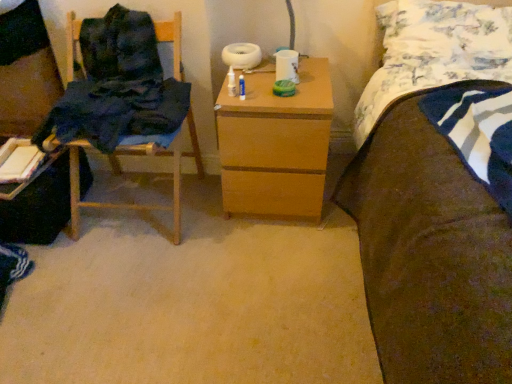
From the picture: What is the approximate height of brown fabric bed at right?

The height of brown fabric bed at right is 86.47 centimeters.

What do you see at coordinates (430, 252) in the screenshot? I see `brown fabric bed at right` at bounding box center [430, 252].

In order to face white cardboard book at left, should I rotate leftwards or rightwards?

To align with it, rotate left about 29.332°.

Measure the distance between point (493,45) and camera.

Point (493,45) and camera are 1.61 meters apart from each other.

Image resolution: width=512 pixels, height=384 pixels. What do you see at coordinates (448, 25) in the screenshot?
I see `floral fabric pillow at upper right` at bounding box center [448, 25].

Locate an element on the screen. The height and width of the screenshot is (384, 512). brown fabric bed at right is located at coordinates (430, 252).

Is point (262, 153) in front of point (436, 9)?

Yes.

Is wooden nightstand at center wider than floral fabric pillow at upper right?

Correct, the width of wooden nightstand at center exceeds that of floral fabric pillow at upper right.

Between wooden nightstand at center and floral fabric pillow at upper right, which one has smaller size?

floral fabric pillow at upper right is smaller.

Consider the image. Does wooden nightstand at center have a lesser height compared to floral fabric pillow at upper right?

No, wooden nightstand at center is not shorter than floral fabric pillow at upper right.

The image size is (512, 384). In order to click on bed in front of the wooden nightstand at center in this screenshot , I will do `click(430, 252)`.

Is wooden nightstand at center next to brown fabric bed at right?

No, wooden nightstand at center is not touching brown fabric bed at right.

Does wooden nightstand at center appear on the right side of brown fabric bed at right?

Incorrect, wooden nightstand at center is not on the right side of brown fabric bed at right.

Is wooden nightstand at center looking in the opposite direction of brown fabric bed at right?

wooden nightstand at center is not turned away from brown fabric bed at right.

In terms of height, does brown fabric bed at right look taller or shorter compared to floral fabric pillow at upper right?

Clearly, brown fabric bed at right is taller compared to floral fabric pillow at upper right.

Consider the image. Can you confirm if brown fabric bed at right is wider than floral fabric pillow at upper right?

Indeed, brown fabric bed at right has a greater width compared to floral fabric pillow at upper right.

Find the location of a particular element. pillow on the right of brown fabric bed at right is located at coordinates (448, 25).

Is point (12, 153) less distant than point (386, 43)?

No, it is not.

Could you tell me if white cardboard book at left is turned towards floral fabric pillow at upper right?

No, white cardboard book at left is not aimed at floral fabric pillow at upper right.

Is white cardboard book at left at the left side of floral fabric pillow at upper right?

Indeed, white cardboard book at left is positioned on the left side of floral fabric pillow at upper right.

Is brown fabric bed at right at the left side of dark blue fabric chair at left?

No, brown fabric bed at right is not to the left of dark blue fabric chair at left.

Looking at the image, does brown fabric bed at right seem bigger or smaller compared to dark blue fabric chair at left?

Considering their sizes, brown fabric bed at right takes up more space than dark blue fabric chair at left.

Considering the positions of objects brown fabric bed at right and dark blue fabric chair at left in the image provided, who is behind, brown fabric bed at right or dark blue fabric chair at left?

Positioned behind is dark blue fabric chair at left.

Consider the image. Would you say brown fabric bed at right is inside or outside dark blue fabric chair at left?

brown fabric bed at right is outside dark blue fabric chair at left.

How many degrees apart are the facing directions of white cardboard book at left and dark blue fabric chair at left?

There is a 3.51-degree angle between the facing directions of white cardboard book at left and dark blue fabric chair at left.

Between white cardboard book at left and dark blue fabric chair at left, which one appears on the left side from the viewer's perspective?

Positioned to the left is dark blue fabric chair at left.

Do you think white cardboard book at left is within dark blue fabric chair at left, or outside of it?

white cardboard book at left cannot be found inside dark blue fabric chair at left.

Is white cardboard book at left oriented away from dark blue fabric chair at left?

Absolutely, white cardboard book at left is directed away from dark blue fabric chair at left.

Between dark blue fabric chair at left and wooden nightstand at center, which one has smaller size?

Smaller between the two is dark blue fabric chair at left.

Does point (62, 88) come closer to viewer compared to point (294, 218)?

No, (62, 88) is behind (294, 218).

Would you say dark blue fabric chair at left contains wooden nightstand at center?

No, wooden nightstand at center is not inside dark blue fabric chair at left.

Where is `nightstand beneath the floral fabric pillow at upper right (from a real-world perspective)`? This screenshot has width=512, height=384. nightstand beneath the floral fabric pillow at upper right (from a real-world perspective) is located at coordinates (276, 145).

Where is `bed in front of the wooden nightstand at center`? bed in front of the wooden nightstand at center is located at coordinates (430, 252).

From the image, which object appears to be nearer to dark blue fabric at left, wooden nightstand at center or floral fabric pillow at upper right?

Among the two, wooden nightstand at center is located nearer to dark blue fabric at left.

From the image, which object appears to be nearer to white cardboard book at left, dark blue fabric chair at left or floral fabric pillow at upper right?

dark blue fabric chair at left.

Looking at this image, based on their spatial positions, is dark blue fabric at left or wooden nightstand at center further from white cardboard book at left?

wooden nightstand at center is further to white cardboard book at left.

Estimate the real-world distances between objects in this image. Which object is further from dark blue fabric at left, wooden chair at left or white cardboard book at left?

white cardboard book at left.

Based on their spatial positions, is brown fabric bed at right or dark blue fabric at left further from dark blue fabric chair at left?

brown fabric bed at right is further to dark blue fabric chair at left.

Considering their positions, is white cardboard book at left positioned closer to wooden chair at left than brown fabric bed at right?

white cardboard book at left.

When comparing their distances from brown fabric bed at right, does white cardboard book at left or wooden nightstand at center seem closer?

wooden nightstand at center lies closer to brown fabric bed at right than the other object.

When comparing their distances from brown fabric bed at right, does floral fabric pillow at upper right or dark blue fabric chair at left seem further?

The object further to brown fabric bed at right is dark blue fabric chair at left.

Identify the location of clothing between dark blue fabric chair at left and brown fabric bed at right. Image resolution: width=512 pixels, height=384 pixels. (115, 112).

Where is `nightstand between white cardboard book at left and brown fabric bed at right`? The width and height of the screenshot is (512, 384). nightstand between white cardboard book at left and brown fabric bed at right is located at coordinates (276, 145).

Identify the location of clothing between white cardboard book at left and floral fabric pillow at upper right in the horizontal direction. This screenshot has height=384, width=512. (115, 112).

This screenshot has width=512, height=384. What are the coordinates of `clothing between dark blue fabric chair at left and floral fabric pillow at upper right in the horizontal direction` in the screenshot? It's located at (115, 112).